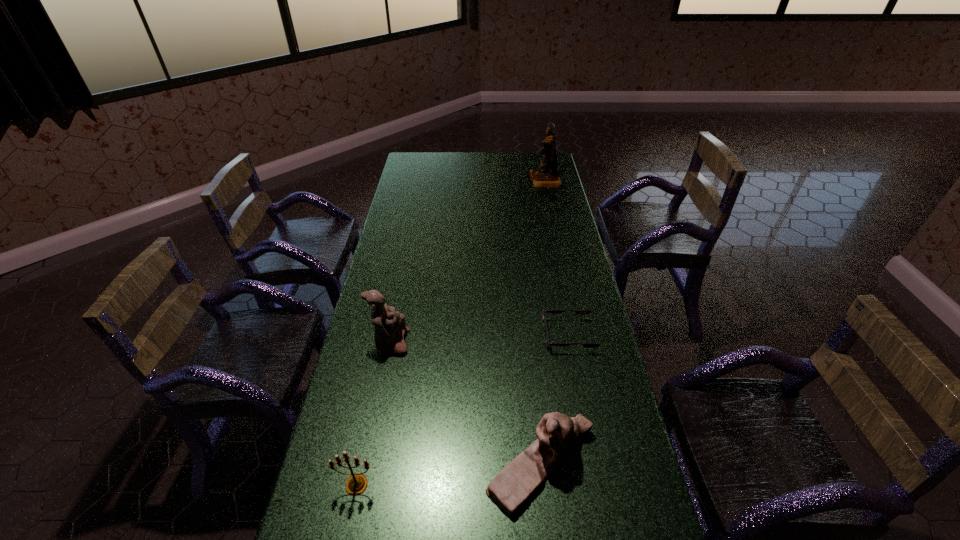
Choose which figurine is the nearest neighbor to the tallest object. Please provide its 2D coordinates. Your answer should be formatted as a tuple, i.e. [(x, y)], where the tuple contains the x and y coordinates of a point satisfying the conditions above.

[(390, 327)]